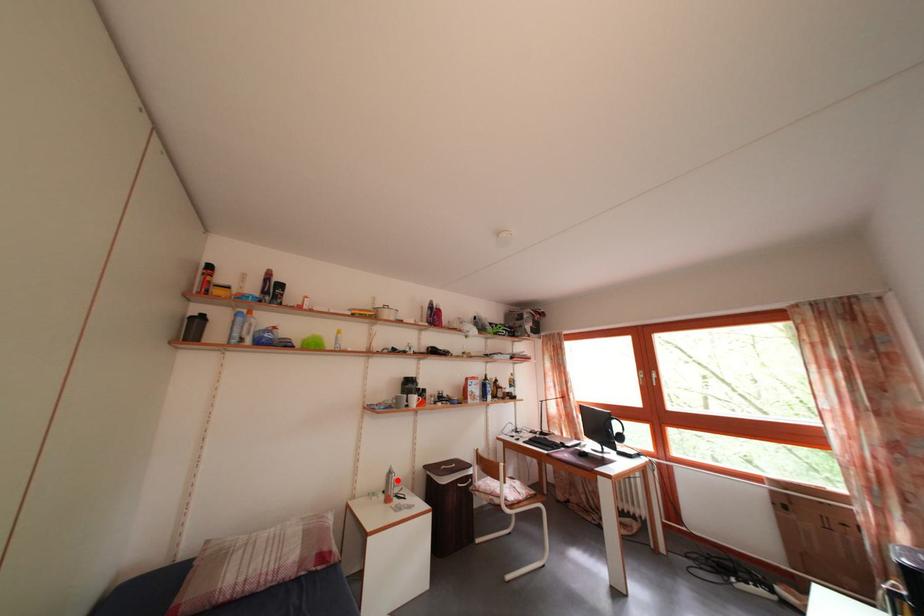
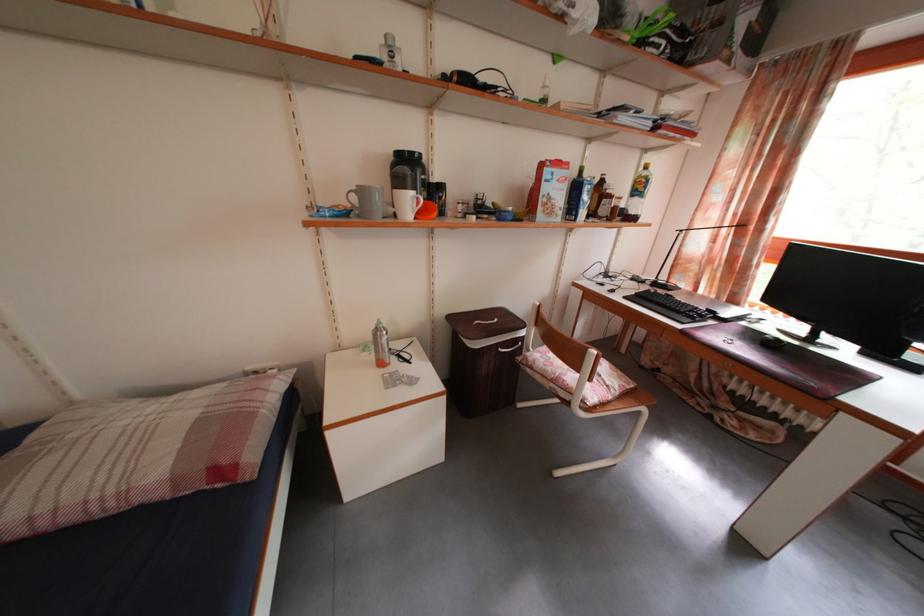
Question: I am providing you with two images of the same scene from different viewpoints. In image1, a red point is highlighted. Considering the same 3D point in image2, which of the following is correct?

Choices:
 (A) It is closer
 (B) It is farther

Answer: (A)